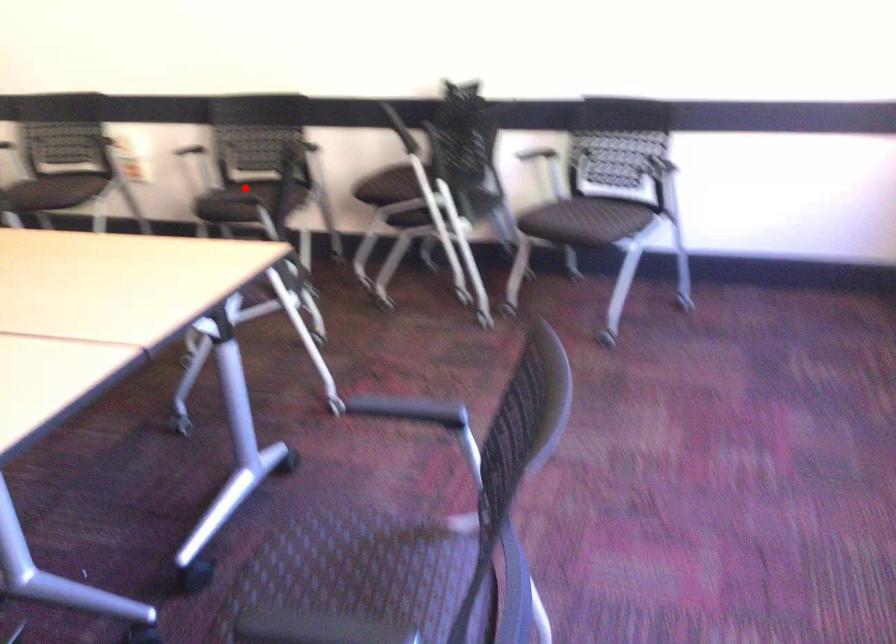
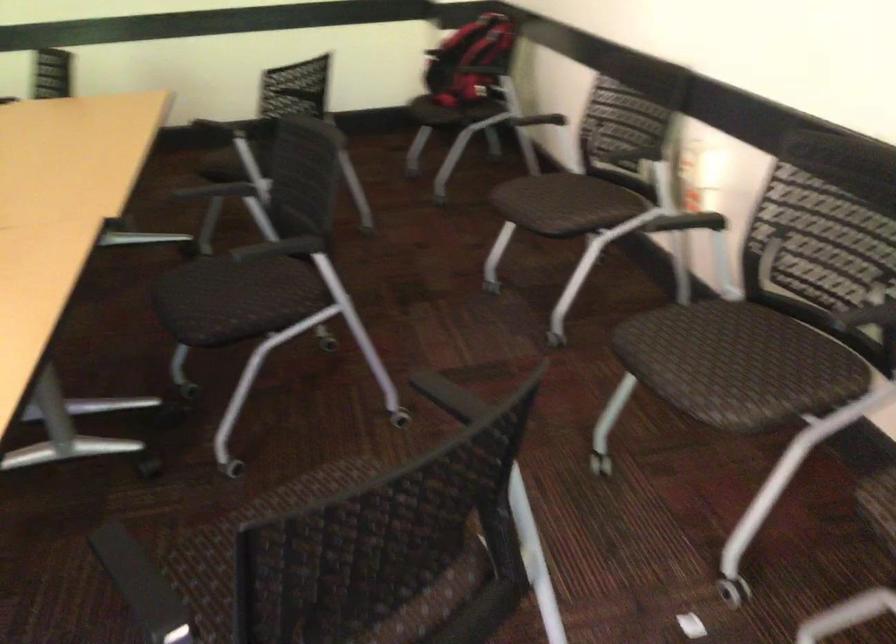
Question: I am providing you with two images of the same scene from different viewpoints. A red point is shown in image1. For the corresponding object point in image2, is it positioned nearer or farther from the camera?

Choices:
 (A) Nearer
 (B) Farther

Answer: (A)